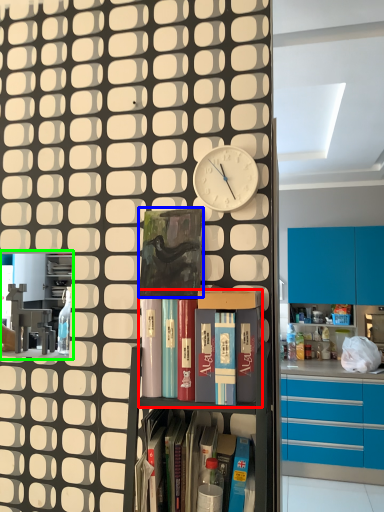
Question: Estimate the real-world distances between objects in this image. Which object is farther from shelf (highlighted by a red box), paperback book (highlighted by a blue box) or shelf (highlighted by a green box)?

Choices:
 (A) paperback book
 (B) shelf

Answer: (B)